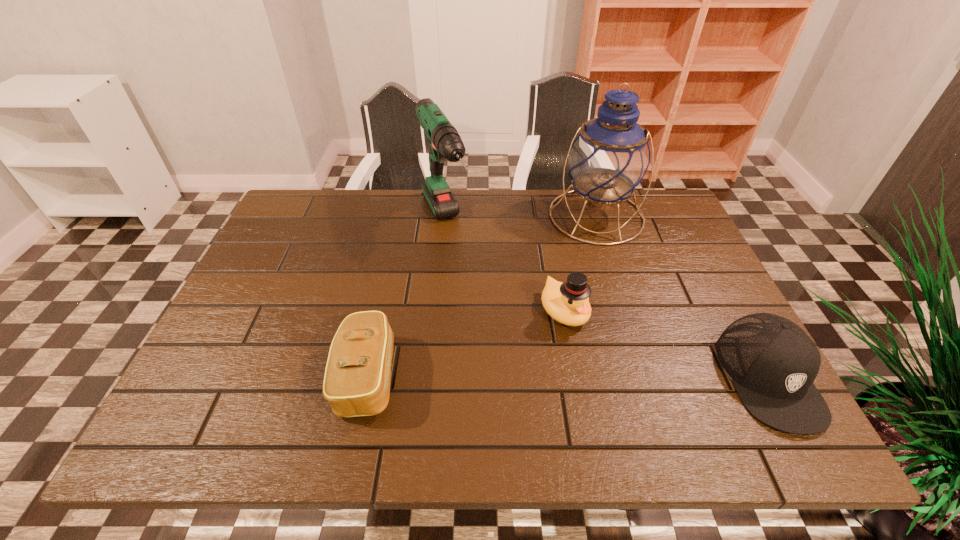
Locate an element on the screen. vacant space that is in between the duck and the fourth shortest object is located at coordinates (505, 267).

You are a GUI agent. You are given a task and a screenshot of the screen. Output one action in this format:
    pyautogui.click(x=<x>, y=<y>)
    Task: Click on the free space between the drill and the rightmost object
    The height and width of the screenshot is (540, 960).
    Given the screenshot: What is the action you would take?
    pyautogui.click(x=607, y=300)

Where is `vacant point located between the cap and the drill`? vacant point located between the cap and the drill is located at coordinates [607, 300].

Image resolution: width=960 pixels, height=540 pixels. I want to click on free spot between the clutch bag and the duck, so click(x=466, y=343).

Image resolution: width=960 pixels, height=540 pixels. I want to click on free spot between the tallest object and the drill, so click(520, 219).

Identify the location of free space between the drill and the tallest object. This screenshot has height=540, width=960. (520, 219).

Find the location of a particular element. The height and width of the screenshot is (540, 960). free spot between the rightmost object and the clutch bag is located at coordinates (568, 376).

This screenshot has height=540, width=960. What are the coordinates of `free area in between the clutch bag and the duck` in the screenshot? It's located at (x=466, y=343).

Image resolution: width=960 pixels, height=540 pixels. Find the location of `empty space that is in between the duck and the clutch bag`. empty space that is in between the duck and the clutch bag is located at coordinates (466, 343).

You are a GUI agent. You are given a task and a screenshot of the screen. Output one action in this format:
    pyautogui.click(x=<x>, y=<y>)
    Task: Click on the object that is the closest to the rightmost object
    Image resolution: width=960 pixels, height=540 pixels.
    Given the screenshot: What is the action you would take?
    pyautogui.click(x=567, y=302)